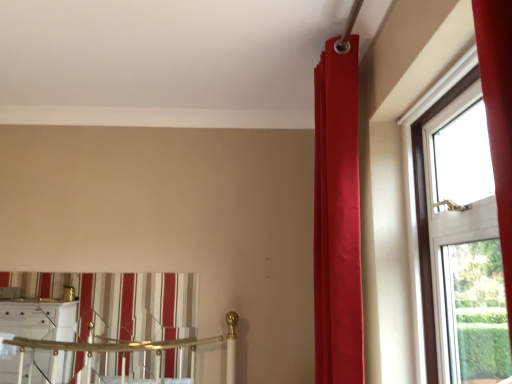
Where is `vacant area on top of striped fabric curtain at lower left, which is the 1th curtain from left to right (from a real-world perspective)`? This screenshot has height=384, width=512. vacant area on top of striped fabric curtain at lower left, which is the 1th curtain from left to right (from a real-world perspective) is located at coordinates (95, 268).